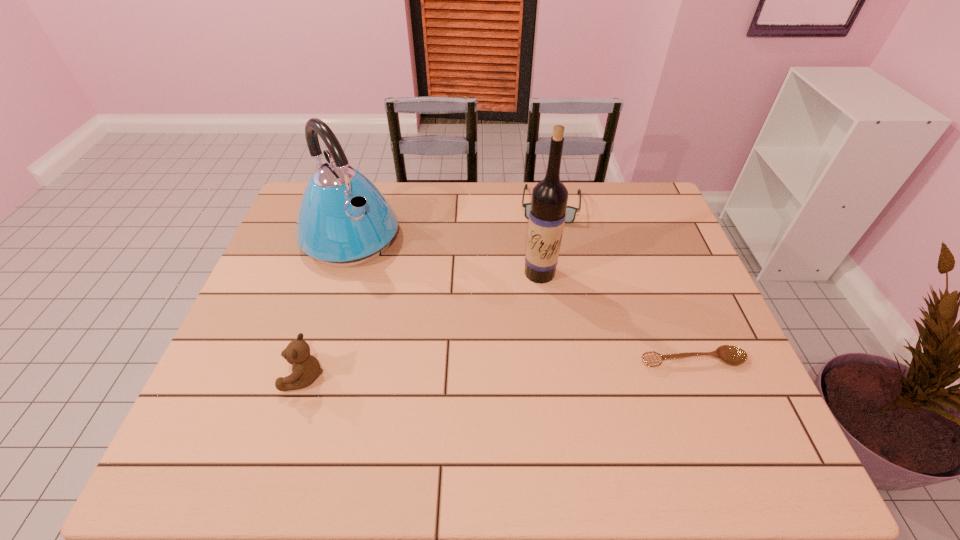
The image size is (960, 540). I want to click on object that is at the near edge, so click(306, 368).

Find the location of a particular element. The image size is (960, 540). teddy bear at the left edge is located at coordinates (306, 368).

Where is `kettle at the left edge`? This screenshot has width=960, height=540. kettle at the left edge is located at coordinates (343, 220).

Find the location of a particular element. This screenshot has height=540, width=960. object at the right edge is located at coordinates (732, 355).

This screenshot has height=540, width=960. Identify the location of object that is at the far left corner. (343, 220).

At what (x,y) coordinates should I click in order to perform the action: click on object that is at the near left corner. Please return your answer as a coordinate pair (x, y). Looking at the image, I should click on (306, 368).

This screenshot has width=960, height=540. Identify the location of vacant space at the far edge. (492, 225).

In the image, there is a desktop. Where is `blank space at the near edge`? The width and height of the screenshot is (960, 540). blank space at the near edge is located at coordinates (396, 386).

Image resolution: width=960 pixels, height=540 pixels. In the image, there is a desktop. In order to click on free space at the left edge in this screenshot , I will do `click(273, 353)`.

Identify the location of vacant area at the right edge of the desktop. This screenshot has width=960, height=540. (698, 278).